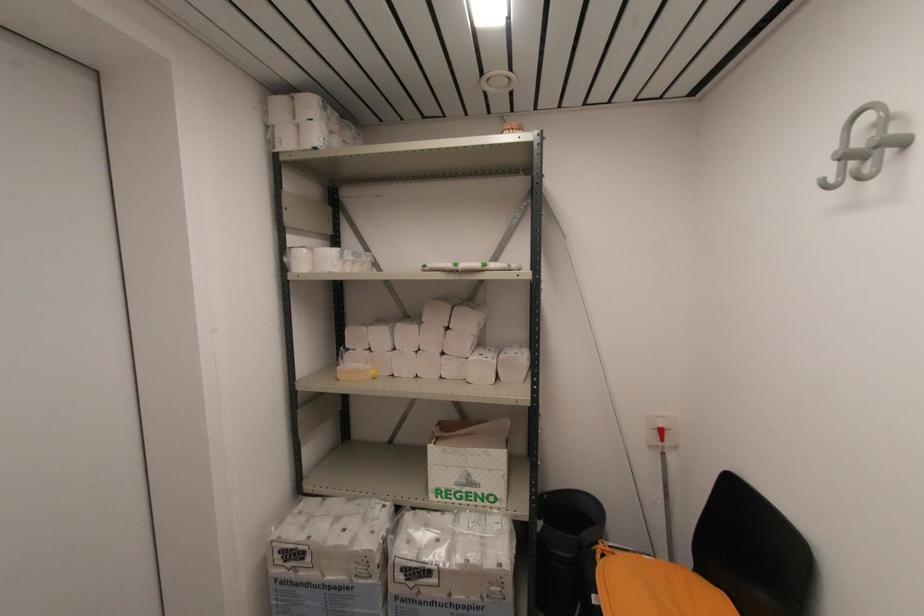
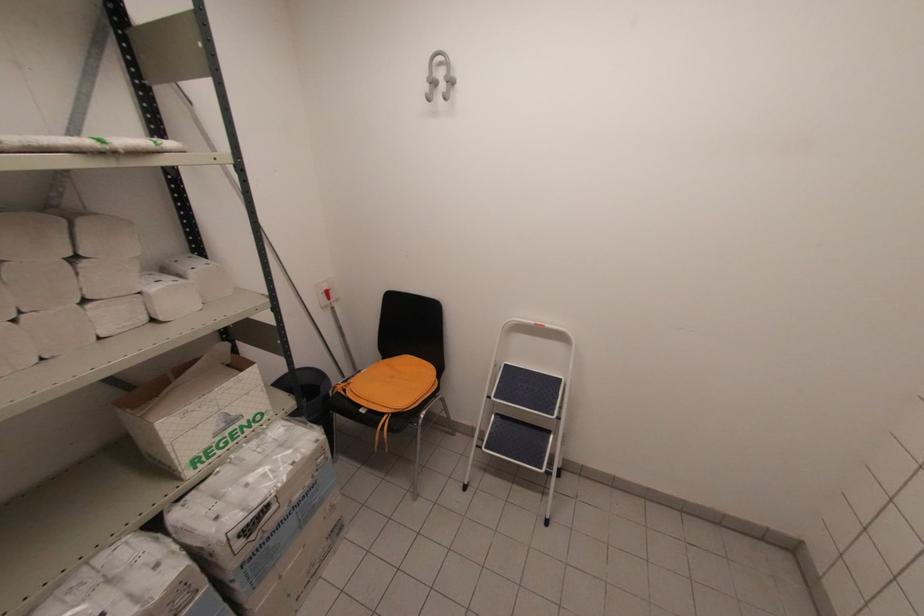
In the second image, find the point that corresponds to (x=843, y=160) in the first image.

(431, 84)